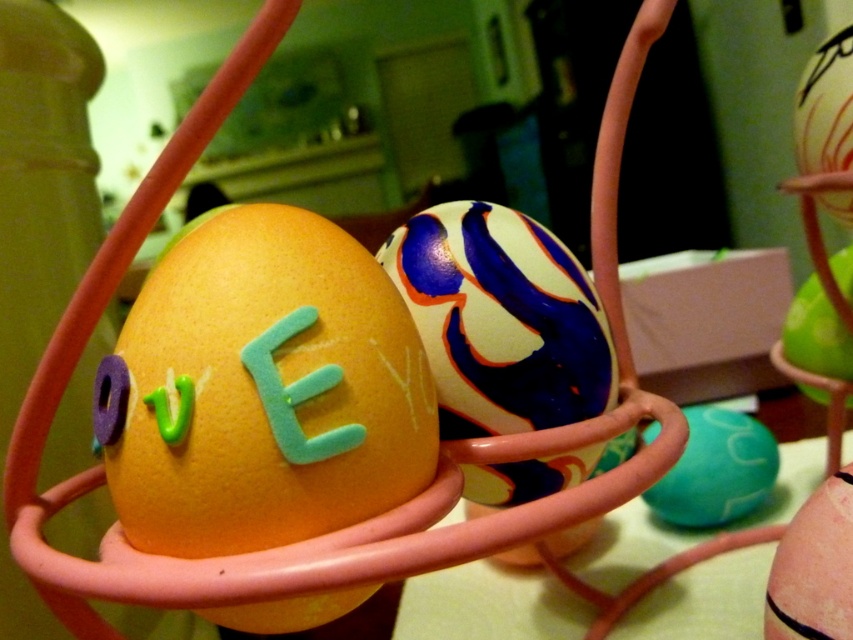
Who is shorter, matte pink egg at center or green matte egg at center?

Standing shorter between the two is matte pink egg at center.

Can you confirm if matte pink egg at center is smaller than green matte egg at center?

Yes, matte pink egg at center is smaller than green matte egg at center.

Describe the element at coordinates (814, 566) in the screenshot. The height and width of the screenshot is (640, 853). I see `matte pink egg at center` at that location.

You are a GUI agent. You are given a task and a screenshot of the screen. Output one action in this format:
    pyautogui.click(x=<x>, y=<y>)
    Task: Click on the matte pink egg at center
    This screenshot has width=853, height=640.
    Given the screenshot: What is the action you would take?
    pyautogui.click(x=814, y=566)

Is orange matte egg at center bigger than matte teal egg at center?

No, orange matte egg at center is not bigger than matte teal egg at center.

Is point (202, 314) positioned in front of point (709, 465)?

Yes, point (202, 314) is in front of point (709, 465).

Find the location of a particular element. orange matte egg at center is located at coordinates (264, 388).

Can you confirm if matte teal egg at center is wider than green matte egg at center?

Indeed, matte teal egg at center has a greater width compared to green matte egg at center.

Between point (729, 422) and point (837, 340), which one is positioned in front?

Point (837, 340) is more forward.

Where is `matte teal egg at center`? The height and width of the screenshot is (640, 853). matte teal egg at center is located at coordinates (717, 470).

This screenshot has height=640, width=853. Identify the location of matte teal egg at center. (717, 470).